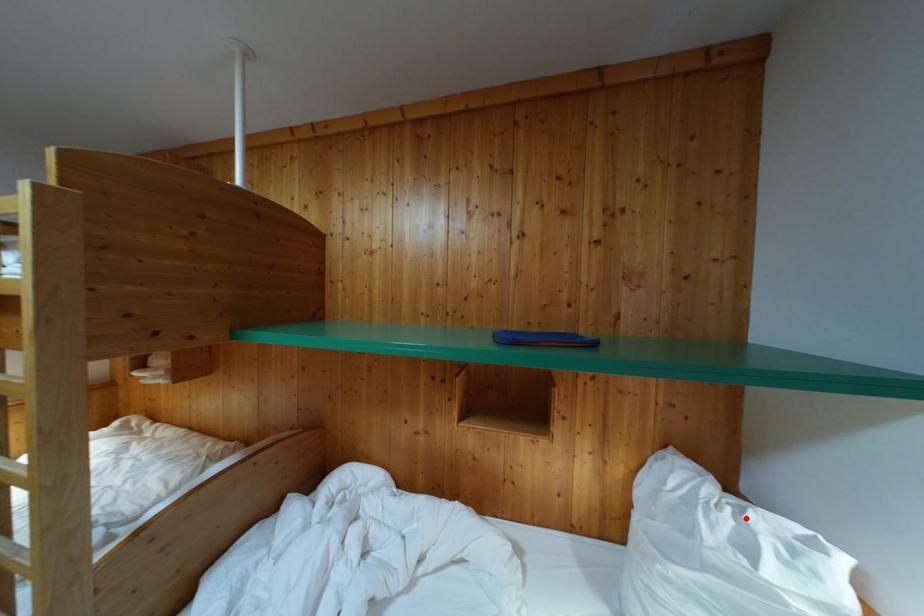
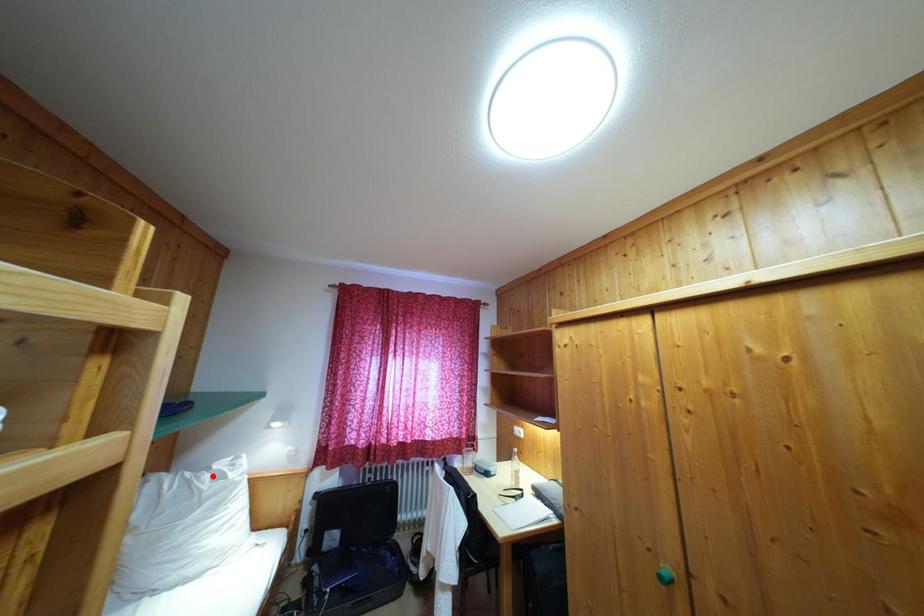
I am providing you with two images of the same scene from different viewpoints. A red point is marked on the first image and another point is marked on the second image. Do the highlighted points in image1 and image2 indicate the same real-world spot?

Yes